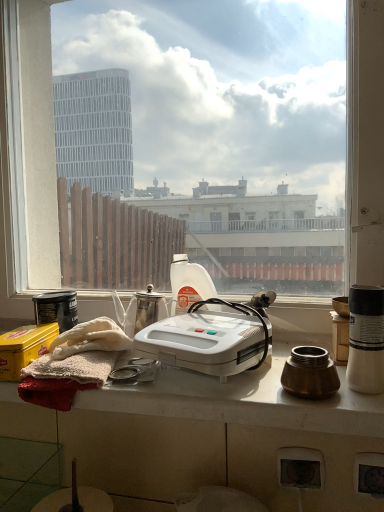
Question: Would you say white plastic waffle maker at center is to the left or to the right of yellow matte tin at lower left in the picture?

Choices:
 (A) left
 (B) right

Answer: (B)

Question: Considering their positions, is white plastic waffle maker at center located in front of or behind yellow matte tin at lower left?

Choices:
 (A) front
 (B) behind

Answer: (A)

Question: Based on their relative distances, which object is farther from the metallic silver teapot at center, which ranks as the 2th appliance in left-to-right order?

Choices:
 (A) matte brown jar at right, placed as the first appliance when sorted from front to back
 (B) matte black canister at left, which is counted as the 2th appliance, starting from the front
 (C) yellow matte tin at lower left
 (D) white glossy coffee cup at right
 (E) white plastic bottle at center

Answer: (D)

Question: Based on their relative distances, which object is nearer to the white glossy coffee cup at right?

Choices:
 (A) metallic silver power plugs and sockets at lower center
 (B) transparent glass window at center
 (C) yellow matte tin at lower left
 (D) white plastic bottle at center
 (E) metallic silver teapot at center, which ranks as the 2th appliance in left-to-right order

Answer: (A)